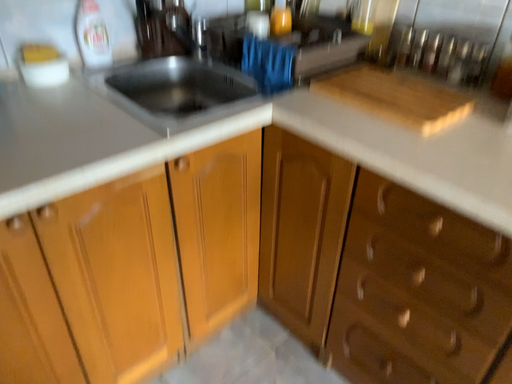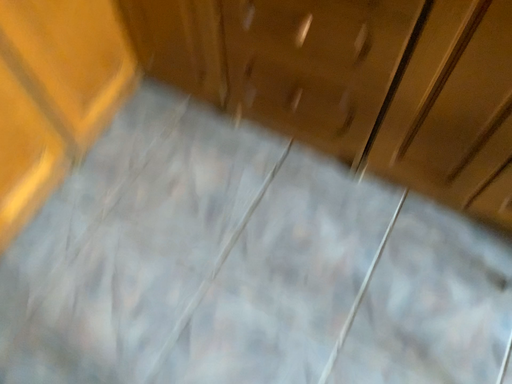
Question: How did the camera likely rotate when shooting the video?

Choices:
 (A) rotated left
 (B) rotated right

Answer: (B)